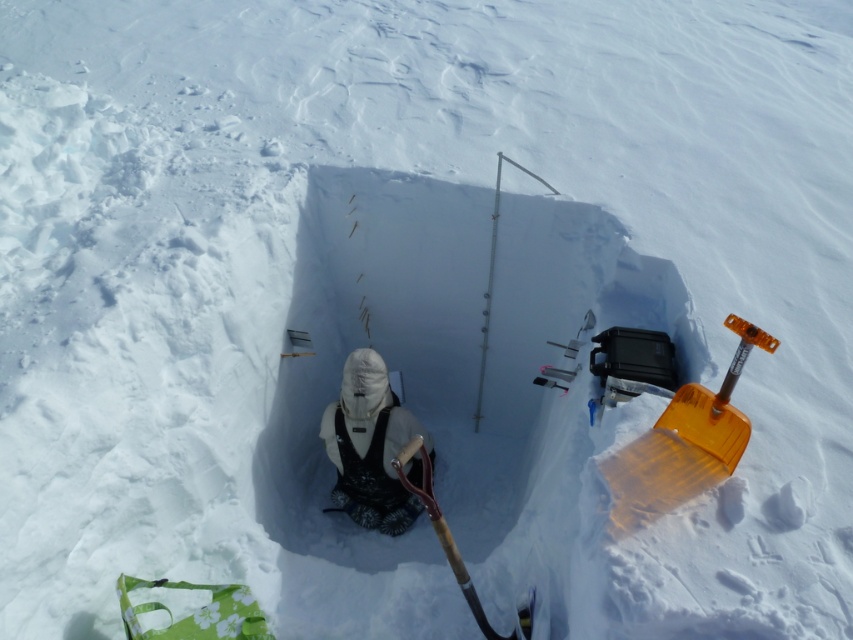
Between point (381, 502) and point (416, 490), which one is positioned in front?

Point (416, 490) is in front.

Does point (370, 497) come in front of point (427, 474)?

No, (370, 497) is further to viewer.

Between point (384, 380) and point (527, 605), which one is positioned behind?

The point (384, 380) is behind.

At what (x,y) coordinates should I click in order to perform the action: click on white fleece jacket at center. Please return your answer as a coordinate pair (x, y). This screenshot has height=640, width=853. Looking at the image, I should click on (370, 445).

Does translucent orange shovel at right lie in front of wooden shovel at center?

Yes, translucent orange shovel at right is closer to the viewer.

Is point (741, 369) closer to camera compared to point (462, 580)?

That is True.

Describe the element at coordinates (682, 445) in the screenshot. The image size is (853, 640). I see `translucent orange shovel at right` at that location.

Image resolution: width=853 pixels, height=640 pixels. I want to click on translucent orange shovel at right, so click(682, 445).

Is translucent orange shovel at right below white fleece jacket at center?

Actually, translucent orange shovel at right is above white fleece jacket at center.

What do you see at coordinates (682, 445) in the screenshot? Image resolution: width=853 pixels, height=640 pixels. I see `translucent orange shovel at right` at bounding box center [682, 445].

Where is `translucent orange shovel at right`? translucent orange shovel at right is located at coordinates (682, 445).